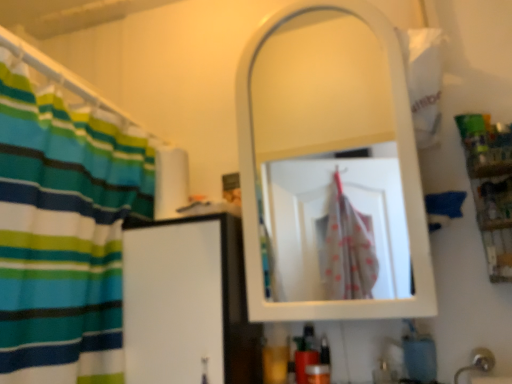
Question: Does white glossy mirror at upper center appear on the right side of blue matte soap at lower right?

Choices:
 (A) no
 (B) yes

Answer: (A)

Question: Is white glossy mirror at upper center in front of blue matte soap at lower right?

Choices:
 (A) yes
 (B) no

Answer: (A)

Question: Can you confirm if white glossy mirror at upper center is bigger than blue matte soap at lower right?

Choices:
 (A) yes
 (B) no

Answer: (A)

Question: Is white glossy mirror at upper center wider than blue matte soap at lower right?

Choices:
 (A) no
 (B) yes

Answer: (B)

Question: Could you tell me if white glossy mirror at upper center is turned towards blue matte soap at lower right?

Choices:
 (A) no
 (B) yes

Answer: (A)

Question: From a real-world perspective, is white glossy mirror at upper center beneath blue matte soap at lower right?

Choices:
 (A) yes
 (B) no

Answer: (B)

Question: Can you see blue matte soap at lower right touching white glossy mirror at upper center?

Choices:
 (A) no
 (B) yes

Answer: (A)

Question: Is blue matte soap at lower right positioned beyond the bounds of white glossy mirror at upper center?

Choices:
 (A) no
 (B) yes

Answer: (B)

Question: Is blue matte soap at lower right positioned before white glossy mirror at upper center?

Choices:
 (A) no
 (B) yes

Answer: (A)

Question: Can white glossy mirror at upper center be found inside blue matte soap at lower right?

Choices:
 (A) yes
 (B) no

Answer: (B)

Question: From the image's perspective, is blue matte soap at lower right located above white glossy mirror at upper center?

Choices:
 (A) no
 (B) yes

Answer: (A)

Question: Is blue matte soap at lower right thinner than white glossy mirror at upper center?

Choices:
 (A) yes
 (B) no

Answer: (A)

Question: Is silver metallic faucet at lower right positioned in front of blue matte soap at lower right?

Choices:
 (A) no
 (B) yes

Answer: (B)